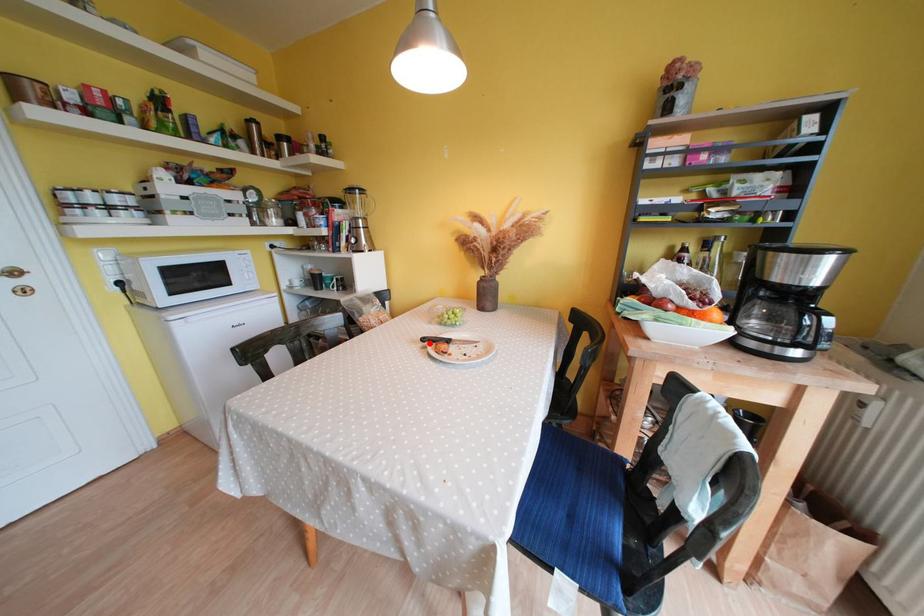
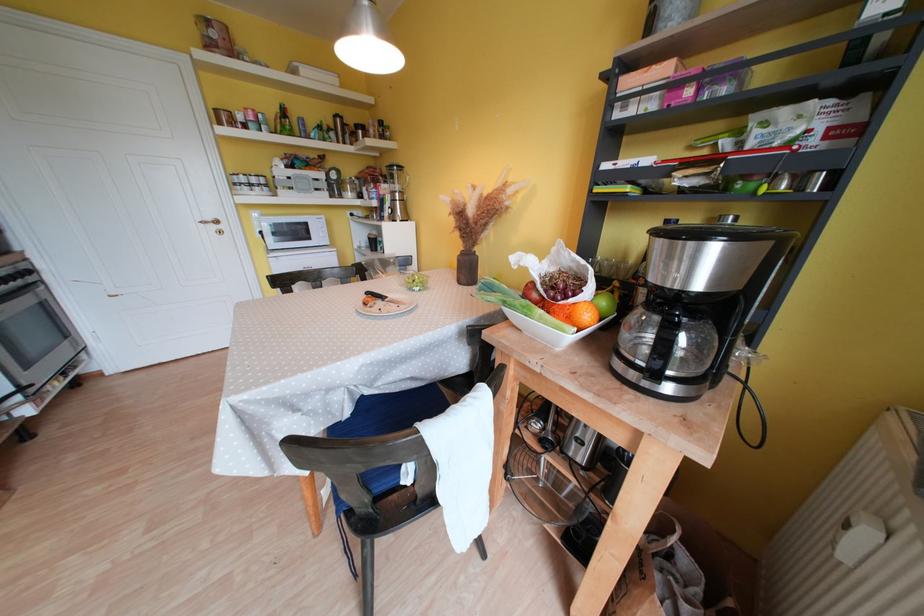
In the second image, find the point that corresponds to the highlighted location in the first image.

(373, 297)